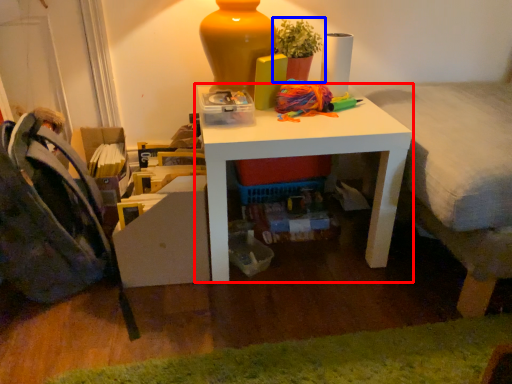
Question: Which point is closer to the camera, table (highlighted by a red box) or houseplant (highlighted by a blue box)?

Choices:
 (A) table
 (B) houseplant

Answer: (A)